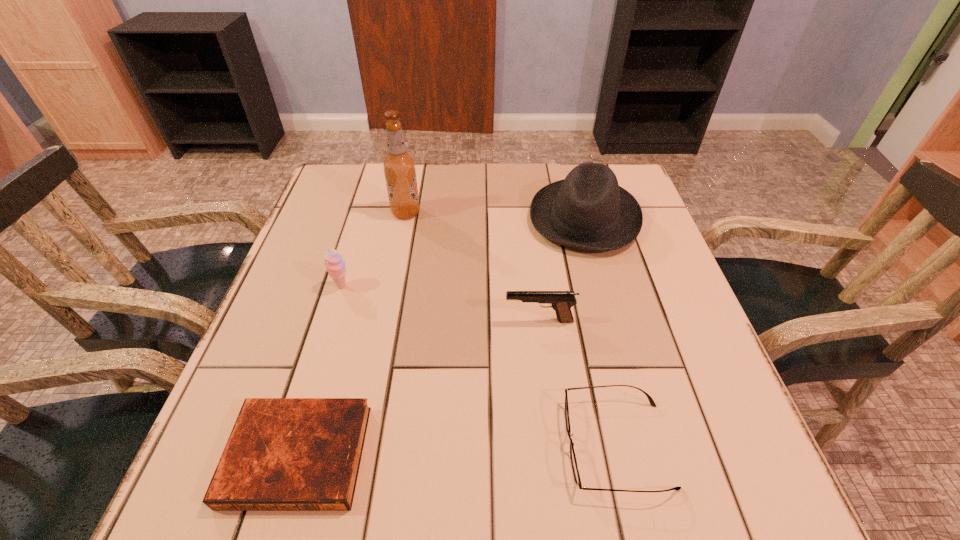
At what (x,y) coordinates should I click in order to perform the action: click on Bible that is at the near edge. Please return your answer as a coordinate pair (x, y). The width and height of the screenshot is (960, 540). Looking at the image, I should click on (283, 454).

Where is `sherbert that is positioned at the left edge`? The height and width of the screenshot is (540, 960). sherbert that is positioned at the left edge is located at coordinates (334, 262).

Find the location of a particular element. Bible at the left edge is located at coordinates 283,454.

The image size is (960, 540). What are the coordinates of `fedora at the right edge` in the screenshot? It's located at (588, 210).

Where is `spectacles positioned at the right edge`? spectacles positioned at the right edge is located at coordinates (576, 474).

This screenshot has height=540, width=960. I want to click on object present at the near left corner, so click(283, 454).

Locate an element on the screen. The image size is (960, 540). object that is at the far right corner is located at coordinates (588, 210).

You are a GUI agent. You are given a task and a screenshot of the screen. Output one action in this format:
    pyautogui.click(x=<x>, y=<y>)
    Task: Click on the object that is at the near right corner
    This screenshot has width=960, height=540.
    Given the screenshot: What is the action you would take?
    pyautogui.click(x=576, y=474)

You are a GUI agent. You are given a task and a screenshot of the screen. Output one action in this format:
    pyautogui.click(x=<x>, y=<y>)
    Task: Click on the vacant space at the far edge
    The width and height of the screenshot is (960, 540).
    Given the screenshot: What is the action you would take?
    pyautogui.click(x=468, y=192)

Identify the location of vacant region at the left edge of the desktop. (357, 212).